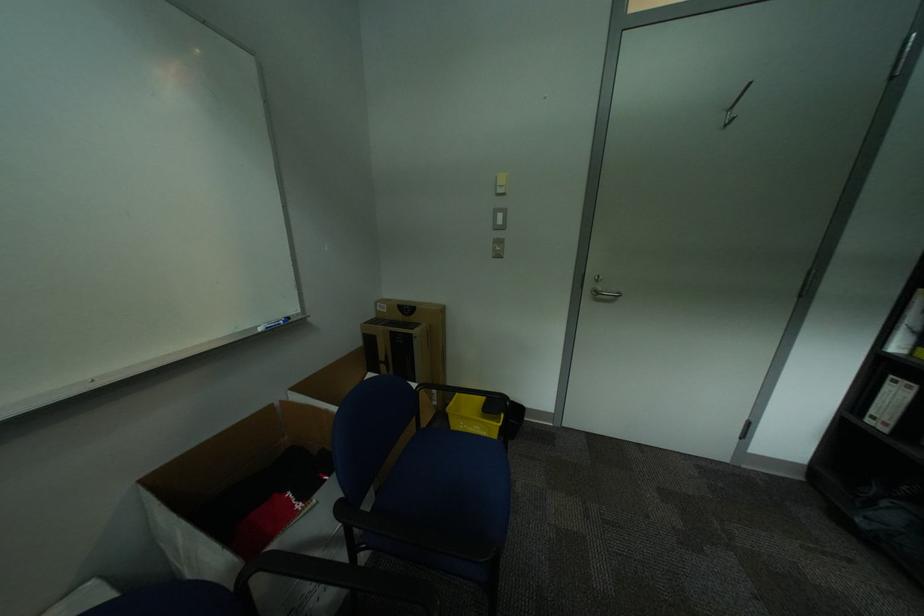
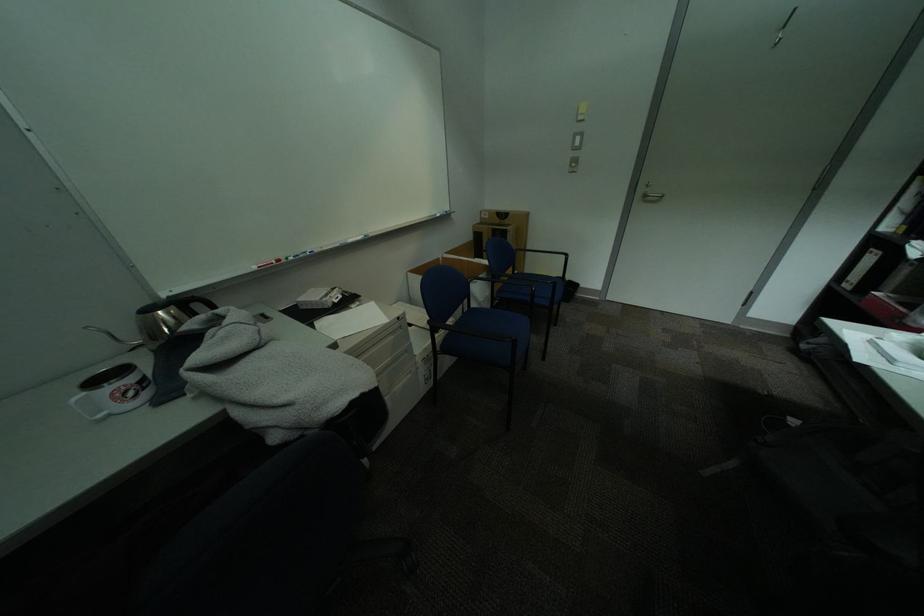
Find the pixel in the second image that matches pixel 606 294 in the first image.

(655, 197)